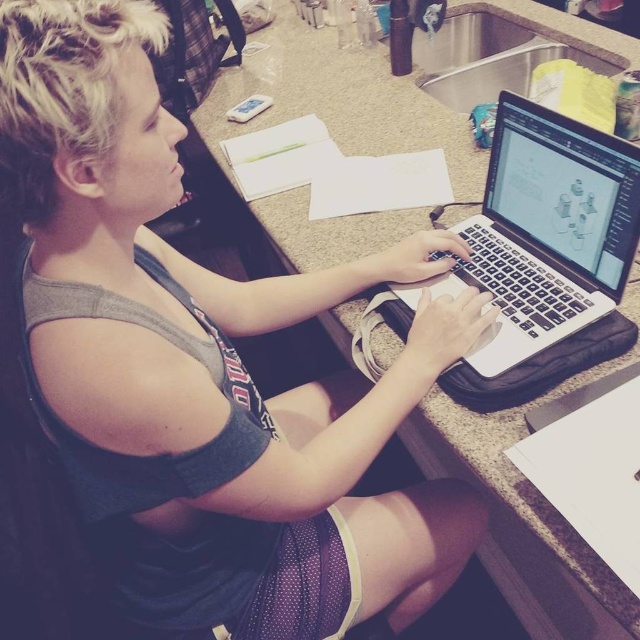
You are a delivery person who needs to place a small package on the granite gray counter top at center. According to the coordinates provided, where exactly should you place it?

The granite gray counter top at center is located at point (330, 134), so you should place the small package there.

You are a delivery person who needs to place a small package on the granite gray counter top at center. However, there is already a satin black laptop at center in the way. Can you place the package directly on the counter top without moving the laptop?

The granite gray counter top at center is positioned over the satin black laptop at center, meaning the laptop is already on the counter. Therefore, you can place the package on the counter top next to the laptop without moving it.

Consider the image. You are a photographer trying to capture a closeup of the granite gray counter top at center. Your camera is positioned at a certain distance. Can you tell me if the camera is close enough to take a clear photo without needing to zoom in?

The granite gray counter top at center and camera are 23.36 inches apart from each other, so yes, the camera is close enough to take a clear photo without needing to zoom in.